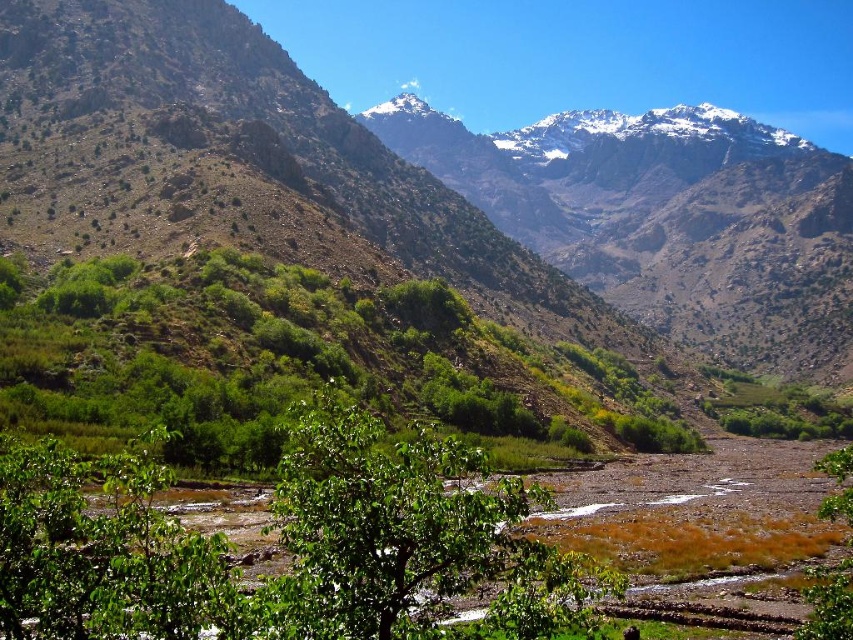
Question: Among these objects, which one is nearest to the camera?

Choices:
 (A) green leafy tree at lower right
 (B) green leafy tree at center

Answer: (A)

Question: Which of the following is the farthest from the observer?

Choices:
 (A) (849, 614)
 (B) (480, 368)

Answer: (B)

Question: Is green leafy tree at center above green leafy tree at lower right?

Choices:
 (A) no
 (B) yes

Answer: (B)

Question: Which point is closer to the camera taking this photo?

Choices:
 (A) (830, 579)
 (B) (80, 392)

Answer: (A)

Question: Considering the relative positions of green leafy tree at center and green leafy tree at lower right in the image provided, where is green leafy tree at center located with respect to green leafy tree at lower right?

Choices:
 (A) above
 (B) below

Answer: (A)

Question: Does green leafy tree at center appear on the right side of green leafy tree at lower right?

Choices:
 (A) yes
 (B) no

Answer: (B)